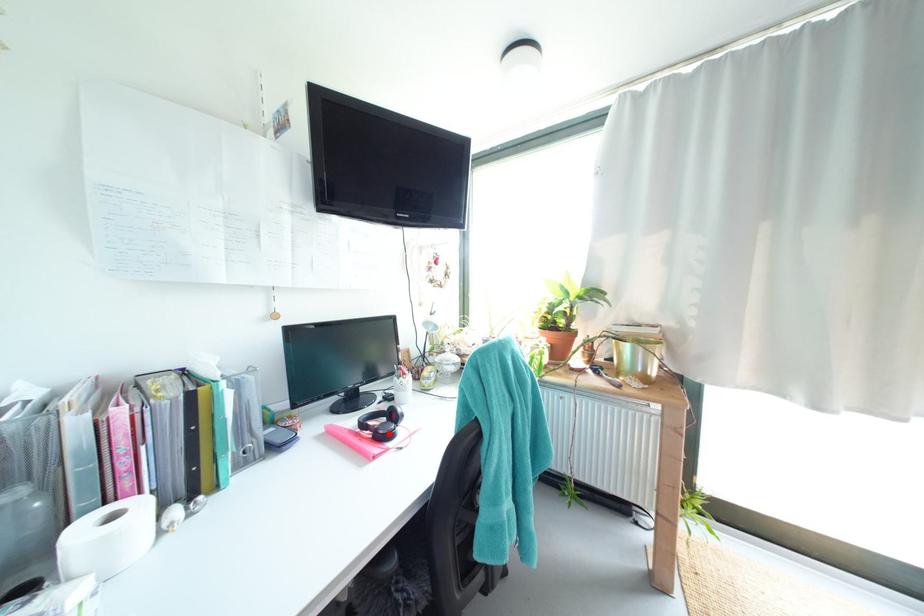
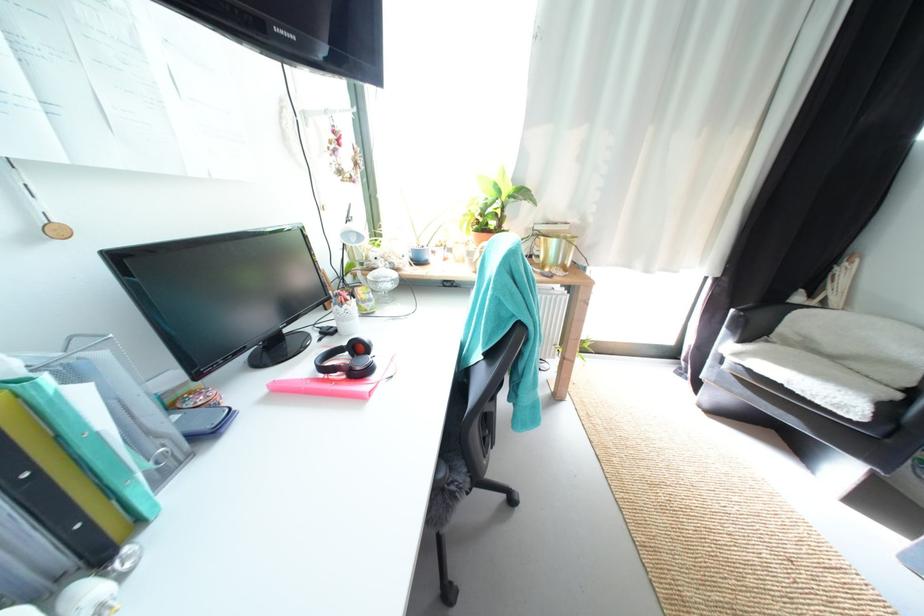
Find the pixel in the second image that matches the highlighted location in the first image.

(367, 370)